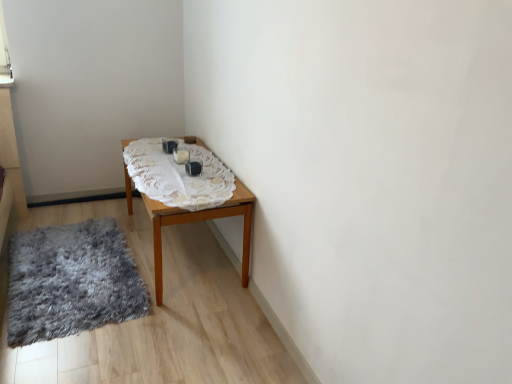
You are a GUI agent. You are given a task and a screenshot of the screen. Output one action in this format:
    pyautogui.click(x=<x>, y=<y>)
    Task: Click on the free spot below wooden table at center (from a real-world perspective)
    The width and height of the screenshot is (512, 384).
    Given the screenshot: What is the action you would take?
    pyautogui.click(x=186, y=254)